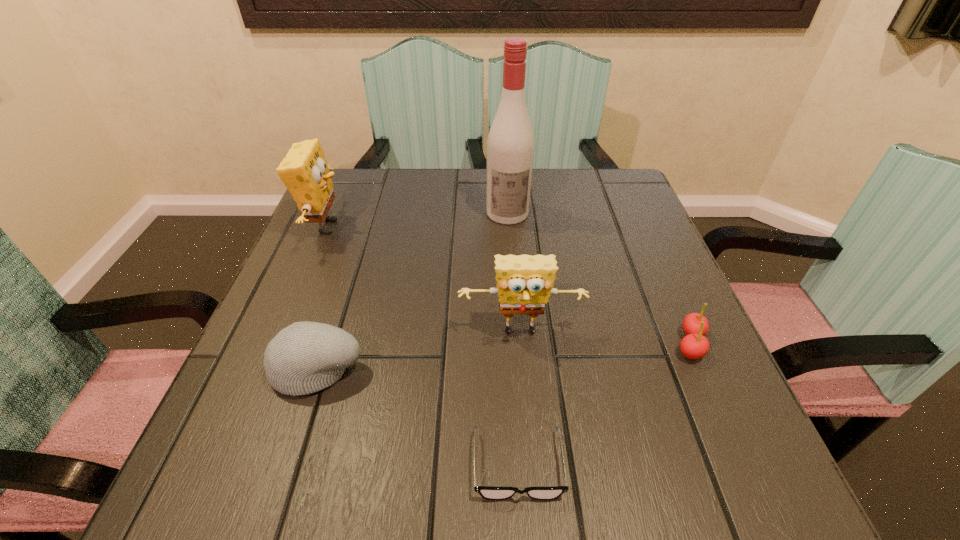
The height and width of the screenshot is (540, 960). In order to click on the tallest object in this screenshot , I will do `click(510, 145)`.

Where is `the second tallest object`? This screenshot has height=540, width=960. the second tallest object is located at coordinates (304, 170).

The width and height of the screenshot is (960, 540). What are the coordinates of `the taller sponge` in the screenshot? It's located at (304, 170).

I want to click on the fourth shortest object, so click(x=524, y=283).

The height and width of the screenshot is (540, 960). In order to click on the nearer sponge in this screenshot , I will do `click(524, 283)`.

Locate an element on the screen. The image size is (960, 540). beanie is located at coordinates (305, 357).

Image resolution: width=960 pixels, height=540 pixels. What are the coordinates of `the second shortest object` in the screenshot? It's located at (694, 345).

You are a GUI agent. You are given a task and a screenshot of the screen. Output one action in this format:
    pyautogui.click(x=<x>, y=<y>)
    Task: Click on the rightmost object
    This screenshot has width=960, height=540.
    Given the screenshot: What is the action you would take?
    pyautogui.click(x=694, y=345)

Identify the location of the shortest object. The height and width of the screenshot is (540, 960). (490, 493).

The image size is (960, 540). In order to click on spectacles in this screenshot , I will do `click(490, 493)`.